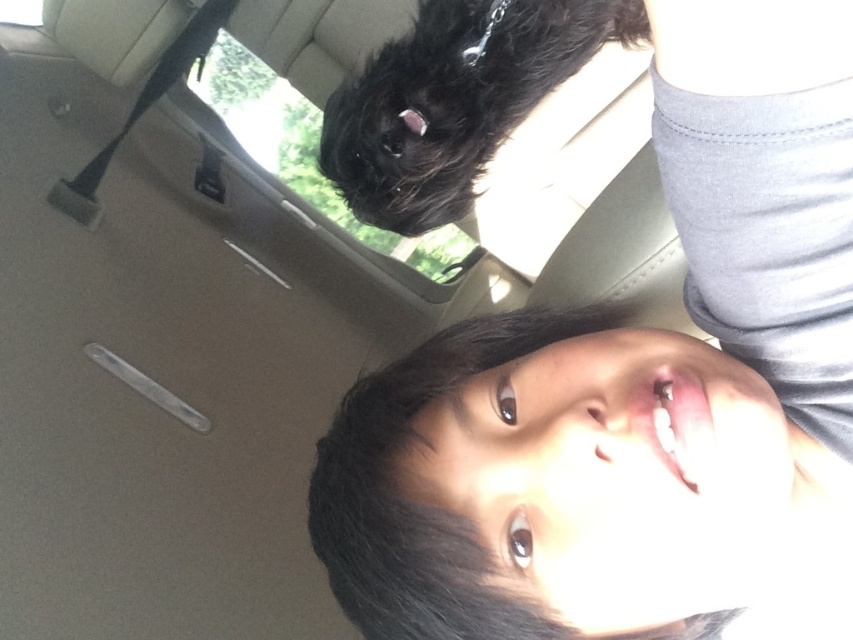
Question: Which of the following is the farthest from the observer?

Choices:
 (A) pyautogui.click(x=450, y=257)
 (B) pyautogui.click(x=407, y=608)

Answer: (A)

Question: Is smooth skin face at center further to the viewer compared to transparent glass window at upper center?

Choices:
 (A) no
 (B) yes

Answer: (A)

Question: Which point is closer to the camera?

Choices:
 (A) transparent glass window at upper center
 (B) smooth skin face at center

Answer: (B)

Question: Can you confirm if smooth skin face at center is positioned above transparent glass window at upper center?

Choices:
 (A) no
 (B) yes

Answer: (A)

Question: Is smooth skin face at center to the left of transparent glass window at upper center from the viewer's perspective?

Choices:
 (A) no
 (B) yes

Answer: (A)